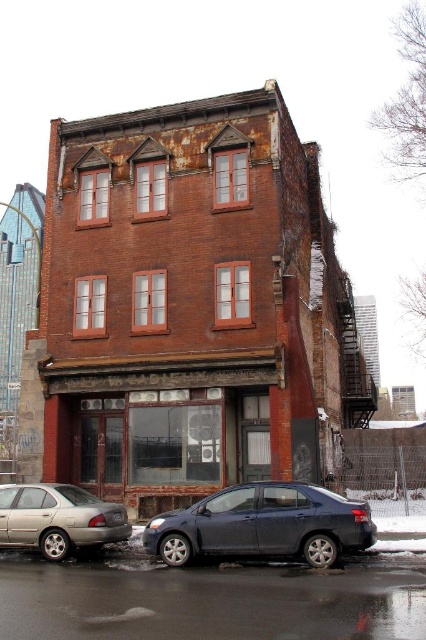
You are a delivery driver who needs to park your truck, which is 2 meters tall, in this area. You see a satin dark blue sedan at lower center and a silver metallic sedan at lower left. Can you safely park your truck between them without hitting the roof?

The satin dark blue sedan at lower center is much taller than the silver metallic sedan at lower left. Since the truck is 2 meters tall, you need to ensure there is enough vertical clearance. However, the description only compares their heights but does not provide specific measurements. Without knowing the exact height of the taller sedan, it is uncertain if the truck can fit safely. Proceed with caution and check the actual space.

You are a delivery person trying to park your van between the satin dark blue sedan at lower center and the silver metallic sedan at lower left. Can you fit your van there if it requires 2 meters of space?

The satin dark blue sedan at lower center is located above the silver metallic sedan at lower left, meaning there is no horizontal space between them for parking. Therefore, you cannot fit your van between them.

You are a parking attendant who needs to fit both the satin dark blue sedan at lower center and the silver metallic sedan at lower left into a parking spot that can only accommodate one car. Which car should you move to ensure it fits?

The parking spot can only fit the smaller car. The satin dark blue sedan at lower center is bigger than the silver metallic sedan at lower left, so you should move the satin dark blue sedan at lower center to make space for the silver metallic sedan at lower left.